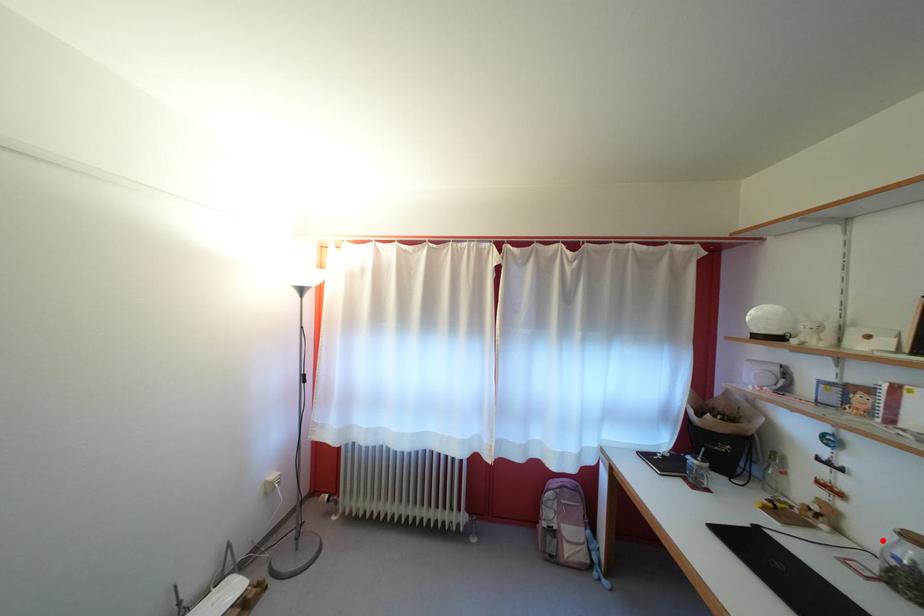
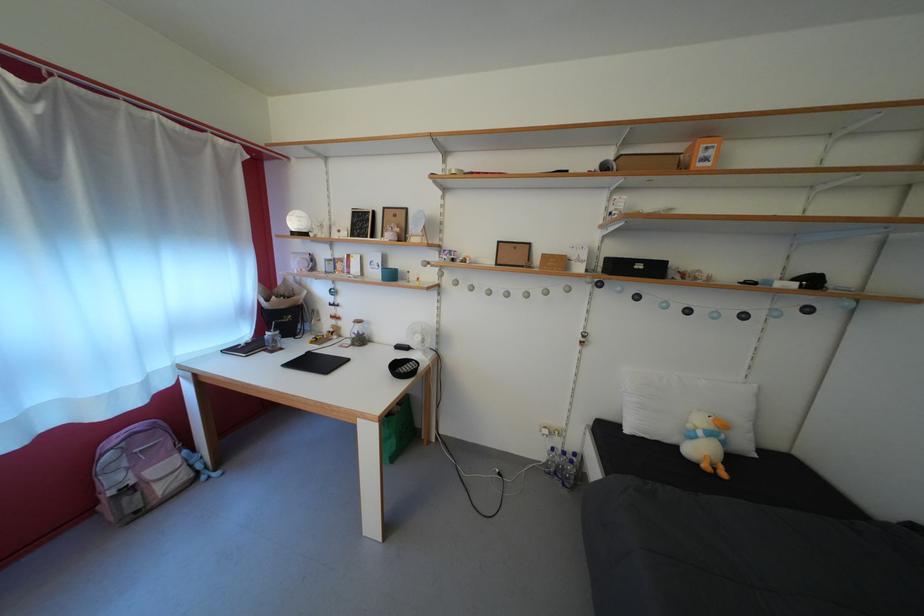
Question: I am providing you with two images of the same scene from different viewpoints. Given a red point in image1, look at the same physical point in image2. Is it:

Choices:
 (A) Closer to the viewpoint
 (B) Farther from the viewpoint

Answer: (B)